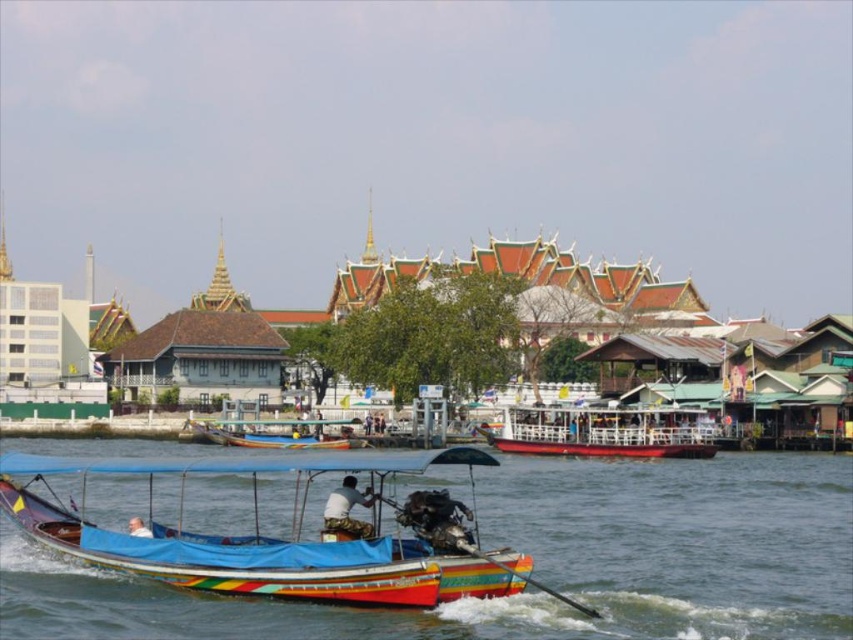
Does golden ornate palace at center have a lesser height compared to white wooden boat at center?

In fact, golden ornate palace at center may be taller than white wooden boat at center.

The height and width of the screenshot is (640, 853). Identify the location of golden ornate palace at center. (602, 301).

Does point (659, 452) come closer to viewer compared to point (271, 420)?

Yes, point (659, 452) is closer to viewer.

Is the position of white wooden boat at center less distant than that of wooden boat at center?

Yes.

Find the location of a particular element. Image resolution: width=853 pixels, height=640 pixels. white wooden boat at center is located at coordinates pyautogui.click(x=604, y=432).

Does golden ornate palace at center have a lesser height compared to wooden boat at center?

No.

Find the location of a particular element. golden ornate palace at center is located at coordinates (602, 301).

I want to click on golden ornate palace at center, so click(602, 301).